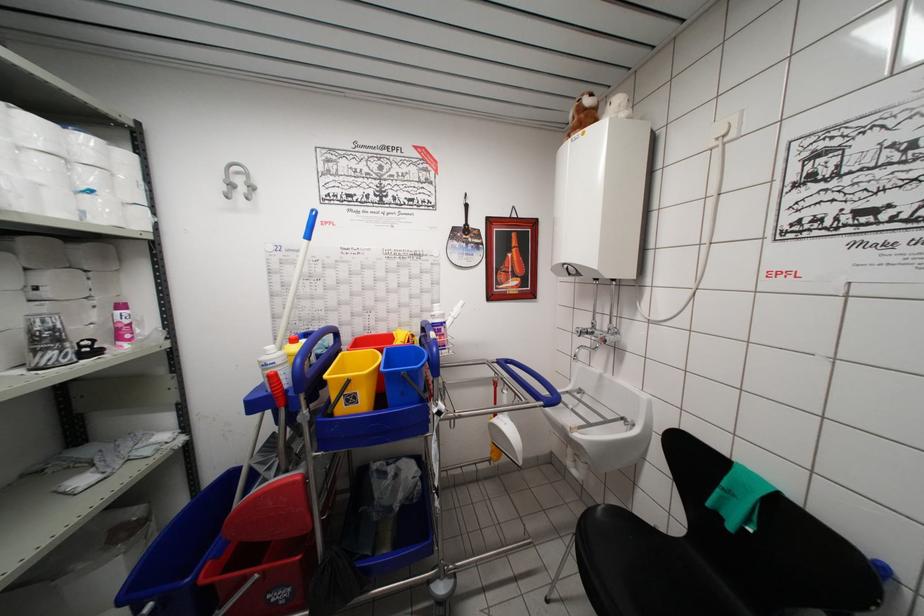
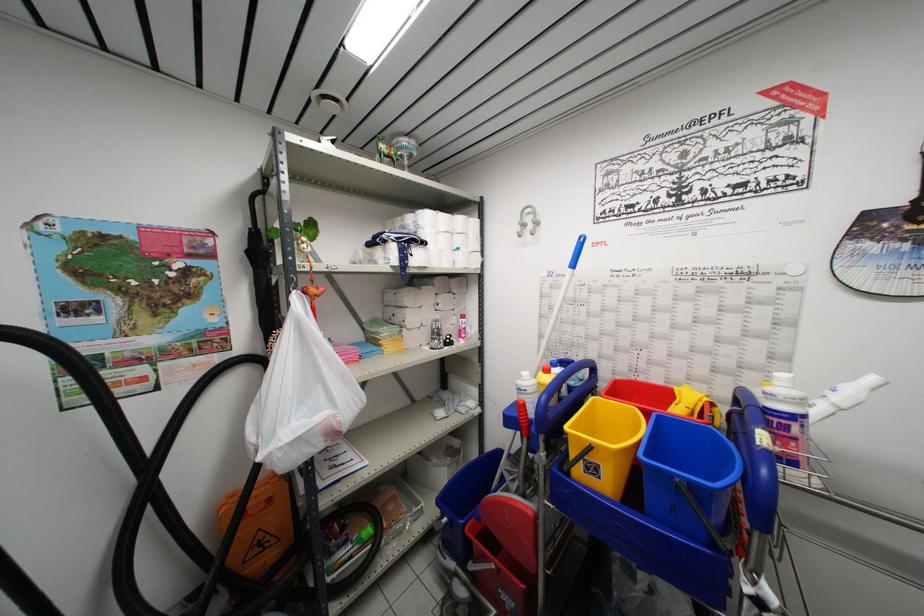
In the second image, find the point that corresponds to point 285,387 in the first image.

(530, 419)